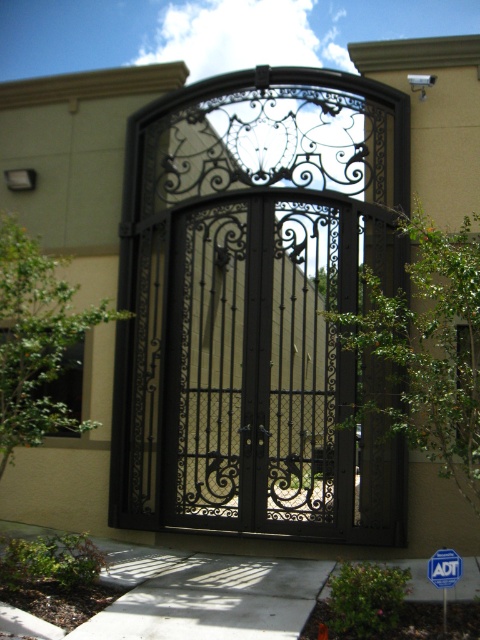
Question: Can you confirm if black wrought iron gate at center is positioned to the left of blue plastic sign at lower right?

Choices:
 (A) yes
 (B) no

Answer: (A)

Question: Is black wrought iron gate at center bigger than blue plastic sign at lower right?

Choices:
 (A) yes
 (B) no

Answer: (A)

Question: Is black wrought iron gate at center thinner than blue plastic sign at lower right?

Choices:
 (A) no
 (B) yes

Answer: (A)

Question: Among these points, which one is farthest from the camera?

Choices:
 (A) [x=278, y=490]
 (B) [x=432, y=570]

Answer: (A)

Question: Which point is closer to the camera taking this photo?

Choices:
 (A) 432,564
 (B) 309,100

Answer: (A)